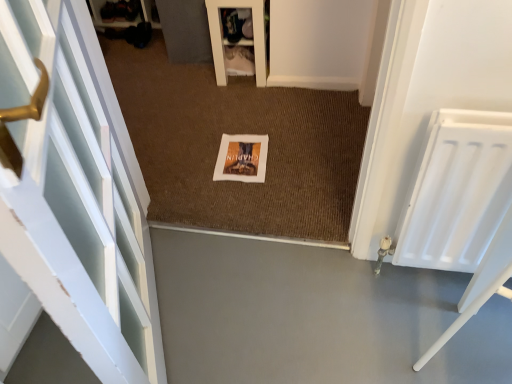
This screenshot has height=384, width=512. Find the location of `empty space that is to the right of white matte picture frame at center`. empty space that is to the right of white matte picture frame at center is located at coordinates (298, 154).